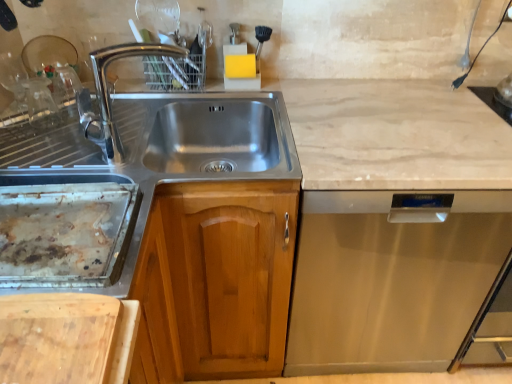
Question: Relative to wooden cutting board at lower left, is wooden cabinet at center in front or behind?

Choices:
 (A) behind
 (B) front

Answer: (A)

Question: From the image's perspective, is wooden cabinet at center above or below wooden cutting board at lower left?

Choices:
 (A) above
 (B) below

Answer: (A)

Question: Considering the real-world distances, which object is closest to the wooden cutting board at lower left?

Choices:
 (A) wooden cabinet at center
 (B) stainless steel dishwasher at right
 (C) chrome metallic faucet at upper left
 (D) rusty metal tray at left

Answer: (D)

Question: Which is farther from the wooden cabinet at center?

Choices:
 (A) rusty metal tray at left
 (B) wooden cutting board at lower left
 (C) chrome metallic faucet at upper left
 (D) stainless steel dishwasher at right

Answer: (C)